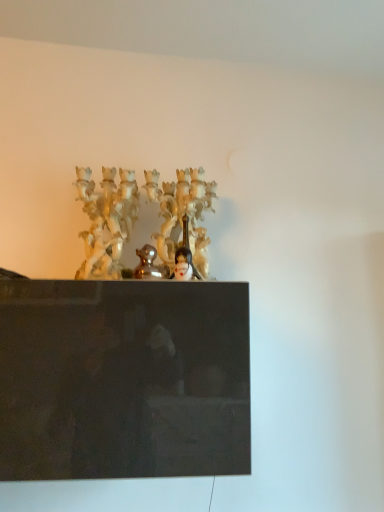
Question: From the image's perspective, is shiny gold duckling at center positioned above or below smooth porcelain figurine at center?

Choices:
 (A) above
 (B) below

Answer: (A)

Question: Is shiny gold duckling at center inside the boundaries of smooth porcelain figurine at center, or outside?

Choices:
 (A) outside
 (B) inside

Answer: (A)

Question: Is shiny gold duckling at center wider or thinner than smooth porcelain figurine at center?

Choices:
 (A) thin
 (B) wide

Answer: (B)

Question: Is smooth porcelain figurine at center taller or shorter than shiny gold duckling at center?

Choices:
 (A) tall
 (B) short

Answer: (B)

Question: From the image's perspective, is smooth porcelain figurine at center positioned above or below shiny gold duckling at center?

Choices:
 (A) above
 (B) below

Answer: (B)

Question: Is smooth porcelain figurine at center spatially inside shiny gold duckling at center, or outside of it?

Choices:
 (A) outside
 (B) inside

Answer: (A)

Question: Does point (198, 279) appear closer or farther from the camera than point (155, 266)?

Choices:
 (A) farther
 (B) closer

Answer: (B)